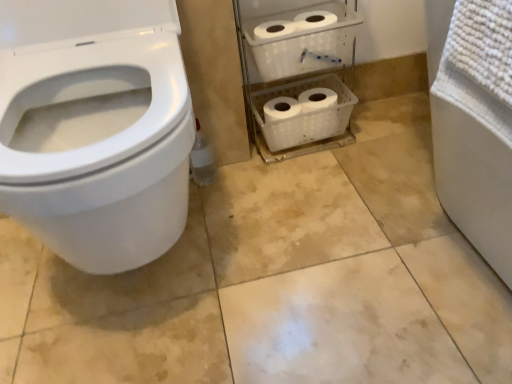
In the scene shown: What is the approximate width of white glossy toilet at left?

white glossy toilet at left is 22.72 inches wide.

The width and height of the screenshot is (512, 384). I want to click on white glossy toilet at left, so click(96, 128).

Describe the element at coordinates (96, 128) in the screenshot. This screenshot has height=384, width=512. I see `white glossy toilet at left` at that location.

This screenshot has width=512, height=384. What do you see at coordinates (302, 74) in the screenshot?
I see `white plastic shelf at center` at bounding box center [302, 74].

Identify the location of white plastic shelf at center. (302, 74).

This screenshot has height=384, width=512. What are the coordinates of `white glossy toilet at left` in the screenshot? It's located at (96, 128).

In the scene shown: Which object is positioned more to the right, white plastic shelf at center or white glossy toilet at left?

white plastic shelf at center.

Between white plastic shelf at center and white glossy toilet at left, which one is positioned behind?

white plastic shelf at center.

Which is behind, point (308, 36) or point (173, 38)?

The point (308, 36) is farther.

From the image's perspective, is white plastic shelf at center located above or below white glossy toilet at left?

Clearly, from the image's perspective, white plastic shelf at center is above white glossy toilet at left.

From a real-world perspective, between white plastic shelf at center and white glossy toilet at left, who is vertically lower?

In real-world perspective, white plastic shelf at center is lower.

Is white plastic shelf at center wider or thinner than white glossy toilet at left?

Considering their sizes, white plastic shelf at center looks slimmer than white glossy toilet at left.

Is white plastic shelf at center taller or shorter than white glossy toilet at left?

Considering their sizes, white plastic shelf at center has less height than white glossy toilet at left.

Based on the photo, can you confirm if white plastic shelf at center is bigger than white glossy toilet at left?

Actually, white plastic shelf at center might be smaller than white glossy toilet at left.

Is white plastic shelf at center located outside white glossy toilet at left?

Yes, white plastic shelf at center is located beyond the bounds of white glossy toilet at left.

Is white plastic shelf at center next to white glossy toilet at left and touching it?

They are not placed beside each other.

Is white plastic shelf at center oriented away from white glossy toilet at left?

No, white plastic shelf at center is not facing away from white glossy toilet at left.

Identify the location of toilet located on the left of white plastic shelf at center. (96, 128).

Can you confirm if white glossy toilet at left is positioned to the right of white plastic shelf at center?

In fact, white glossy toilet at left is to the left of white plastic shelf at center.

Which is in front, white glossy toilet at left or white plastic shelf at center?

white glossy toilet at left is in front.

Between point (69, 133) and point (333, 88), which one is positioned behind?

The point (333, 88) is more distant.

In the scene shown: From the image's perspective, would you say white glossy toilet at left is positioned over white plastic shelf at center?

Actually, white glossy toilet at left appears below white plastic shelf at center in the image.

From a real-world perspective, relative to white plastic shelf at center, is white glossy toilet at left vertically above or below?

white glossy toilet at left is situated higher than white plastic shelf at center in the real world.

In the scene shown: Which of these two, white glossy toilet at left or white plastic shelf at center, is thinner?

Thinner between the two is white plastic shelf at center.

Which of these two, white glossy toilet at left or white plastic shelf at center, stands taller?

With more height is white glossy toilet at left.

In terms of size, does white glossy toilet at left appear bigger or smaller than white plastic shelf at center?

white glossy toilet at left is bigger than white plastic shelf at center.

Which is correct: white glossy toilet at left is inside white plastic shelf at center, or outside of it?

white glossy toilet at left is not enclosed by white plastic shelf at center.

Is white glossy toilet at left touching white plastic shelf at center?

white glossy toilet at left and white plastic shelf at center are clearly separated.

Does white glossy toilet at left turn towards white plastic shelf at center?

No, white glossy toilet at left is not aimed at white plastic shelf at center.

How different are the orientations of white glossy toilet at left and white plastic shelf at center in degrees?

The facing directions of white glossy toilet at left and white plastic shelf at center are 1.22 degrees apart.

The width and height of the screenshot is (512, 384). Identify the location of shelf on the right of the white glossy toilet at left. (302, 74).

Locate an element on the screen. This screenshot has width=512, height=384. shelf that is behind the white glossy toilet at left is located at coordinates pos(302,74).

Locate an element on the screen. The height and width of the screenshot is (384, 512). shelf lying above the white glossy toilet at left (from the image's perspective) is located at coordinates (302, 74).